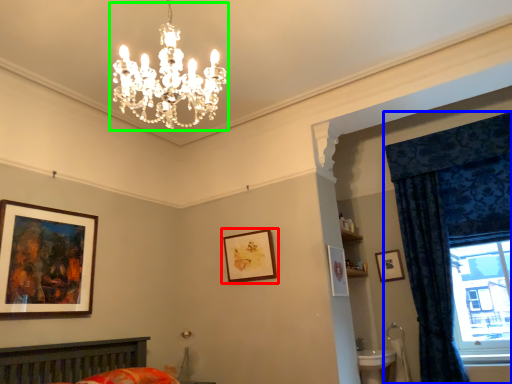
Question: Based on their relative distances, which object is farther from picture frame (highlighted by a red box)? Choose from curtain (highlighted by a blue box) and light fixture (highlighted by a green box).

Choices:
 (A) curtain
 (B) light fixture

Answer: (A)